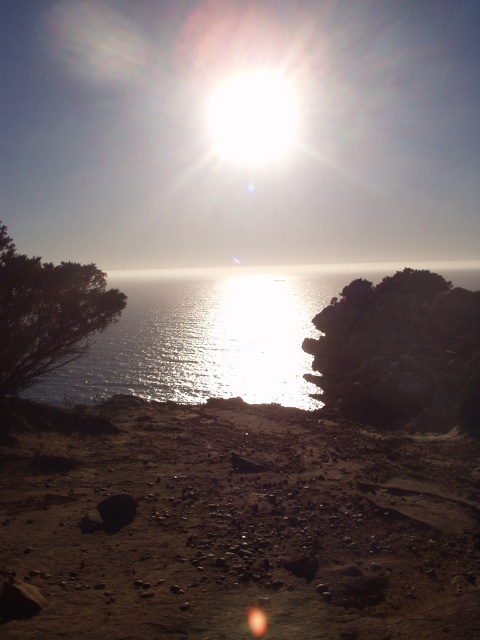
You are a photographer trying to capture the reflection of the sun on the water. You have a camera with a 10cm wide lens. The silvery reflective water at center and dark rock at right are in your shot. Which object will the lens cover more of its width?

The silvery reflective water at center has a greater width than the dark rock at right, so the lens will cover more of the silvery reflective water at center.

You are standing on the beach and want to place a 10 feet long wooden board horizontally on the dull brown sand at lower center. Can the board fit entirely on the sand without overhanging?

The distance between you and the dull brown sand at lower center is 15.42 feet. Since the board is 10 feet long, it can fit entirely on the sand as the sand is sufficiently wide to accommodate its length.

You are standing on the beach and want to reach the point marked as point [75,378]. If you walk straight ahead, will you reach that point before walking 100 meters?

The distance between you and point [75,378] is 76.71 meters, so yes, you will reach it before walking 100 meters.